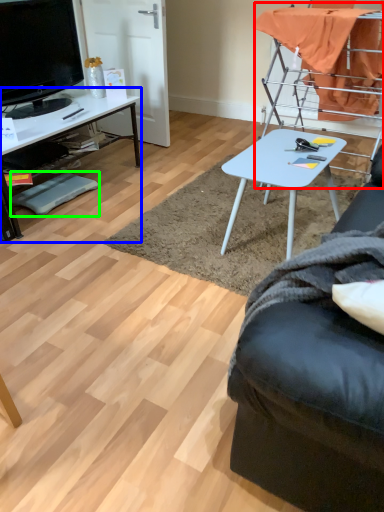
Question: Which object is positioned farthest from chair (highlighted by a red box)? Select from desk (highlighted by a blue box) and footrest (highlighted by a green box).

Choices:
 (A) desk
 (B) footrest

Answer: (B)